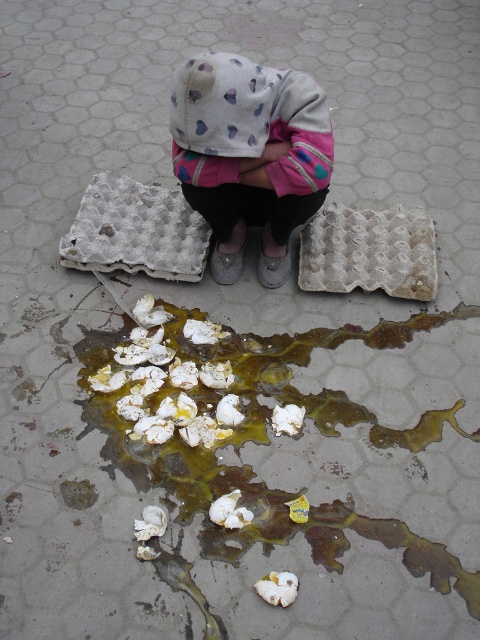
You are standing 5 feet away from the white cotton hoodie at center. Can you reach it without moving your feet?

The white cotton hoodie at center is 4.86 feet from viewer. Since you are standing 5 feet away, it is slightly farther than the hoodie, so you might not be able to reach it without moving closer.